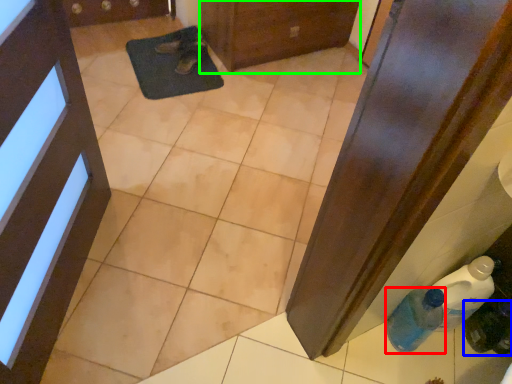
Question: Considering the real-world distances, which object is farthest from bottle (highlighted by a red box)? bottle (highlighted by a blue box) or door (highlighted by a green box)?

Choices:
 (A) bottle
 (B) door

Answer: (B)